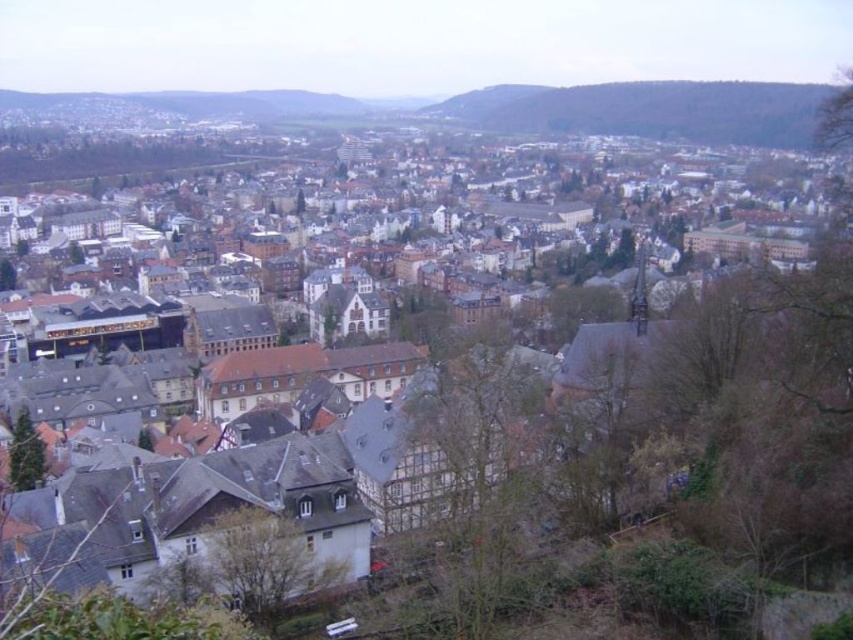
Between green grassy hillside at upper right and green leafy tree at upper right, which one appears on the left side from the viewer's perspective?

green leafy tree at upper right is more to the left.

Does green grassy hillside at upper right have a lesser width compared to green leafy tree at upper right?

Incorrect, green grassy hillside at upper right's width is not less than green leafy tree at upper right's.

This screenshot has height=640, width=853. I want to click on green grassy hillside at upper right, so click(x=648, y=109).

Is green grassy hillside at upper right wider than green leafy tree at lower center?

Correct, the width of green grassy hillside at upper right exceeds that of green leafy tree at lower center.

Is point (575, 113) positioned before point (234, 538)?

No, it is behind (234, 538).

Who is more distant from viewer, (569, 104) or (294, 540)?

The point (569, 104) is more distant.

Locate an element on the screen. Image resolution: width=853 pixels, height=640 pixels. green grassy hillside at upper right is located at coordinates (648, 109).

Does green leafy tree at upper right have a greater height compared to green leafy tree at lower left?

Yes.

Measure the distance between green leafy tree at upper right and camera.

They are 413.49 feet apart.

Does point (822, 134) lie behind point (10, 289)?

That is False.

This screenshot has height=640, width=853. In order to click on green leafy tree at upper right in this screenshot , I will do coord(834,118).